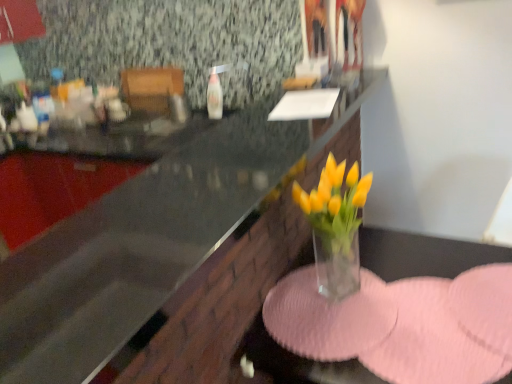
Where is `blank space above transparent glass vase at center (from a real-world perspective)`? The width and height of the screenshot is (512, 384). blank space above transparent glass vase at center (from a real-world perspective) is located at coordinates (413, 306).